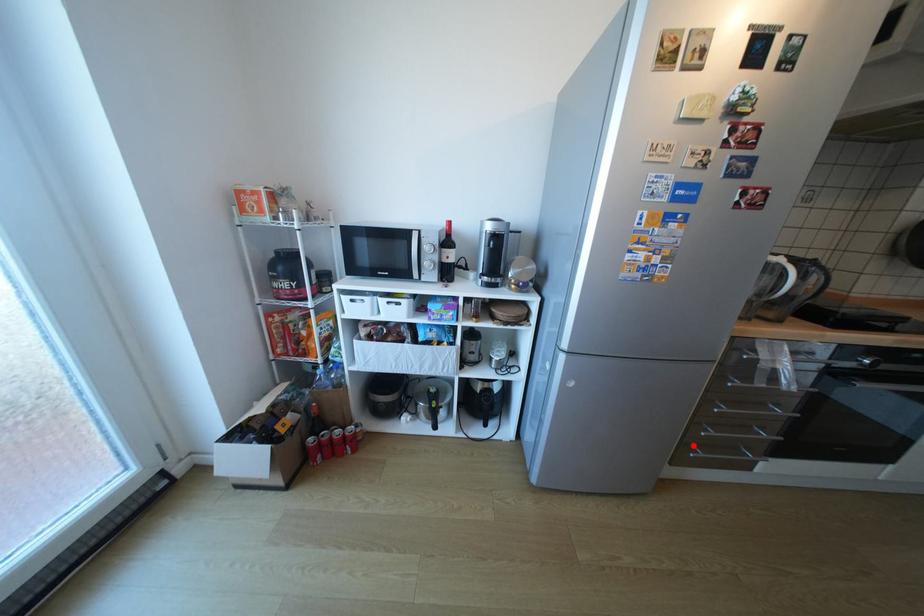
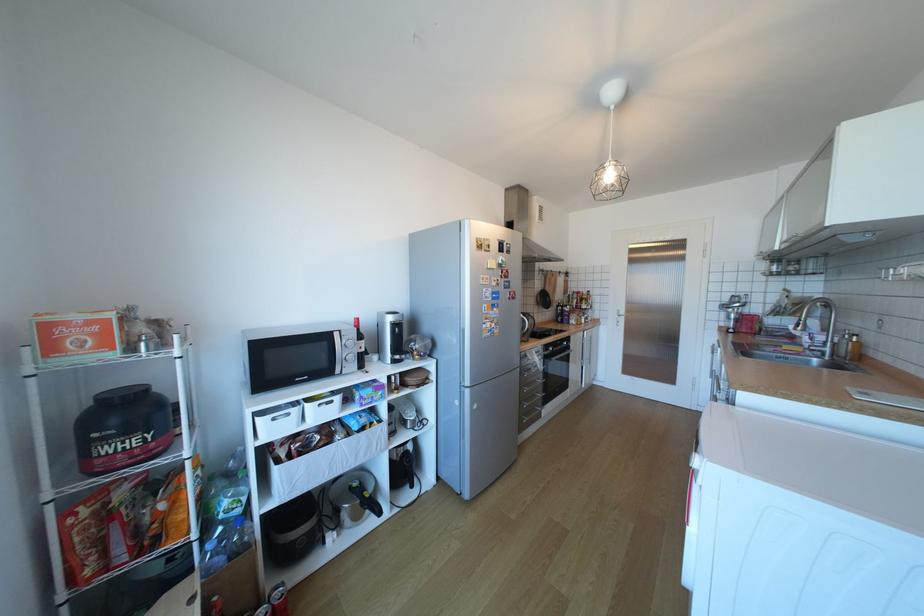
Find the pixel in the second image that matches the highlighted location in the first image.

(529, 419)